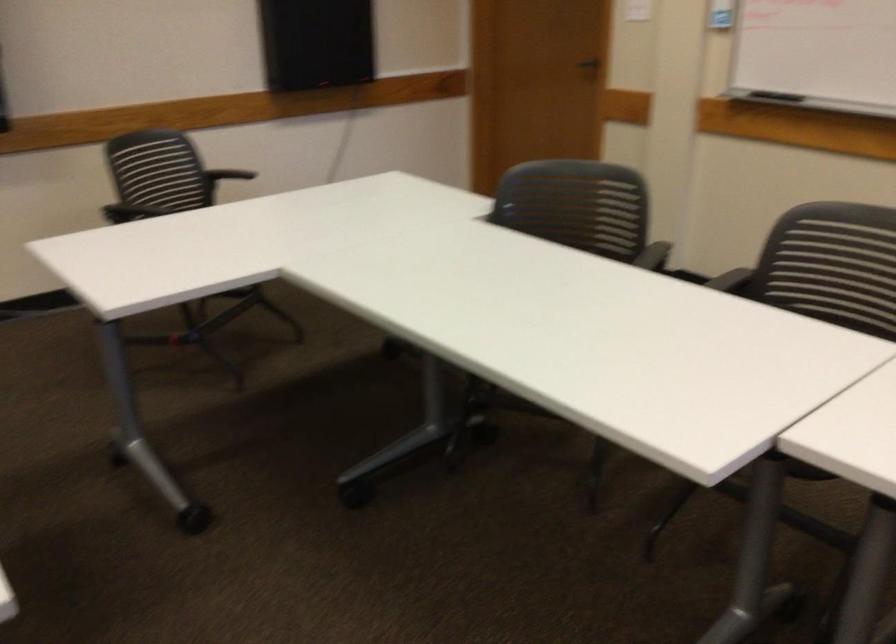
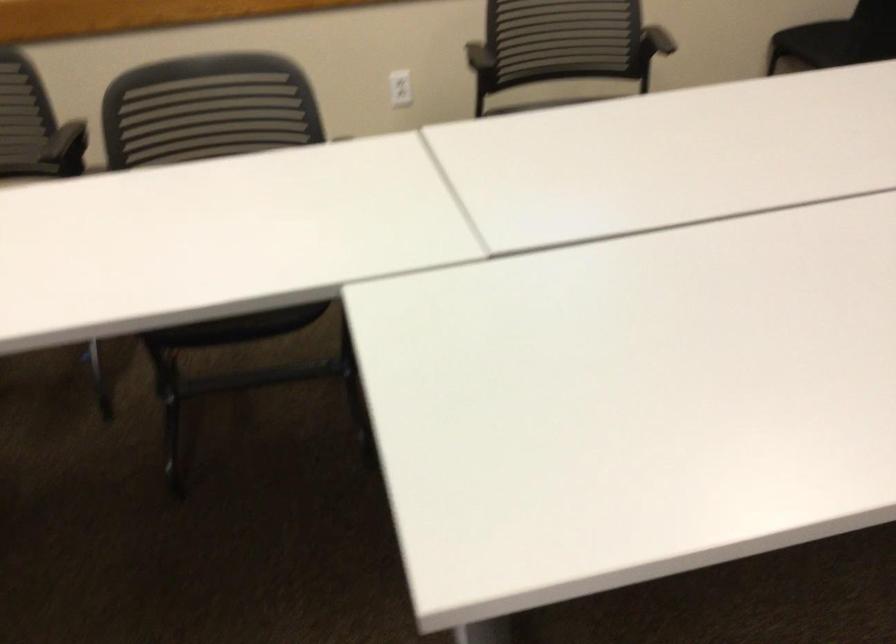
The first image is from the beginning of the video and the second image is from the end. How did the camera likely rotate when shooting the video?

The camera's rotation is toward left-down.